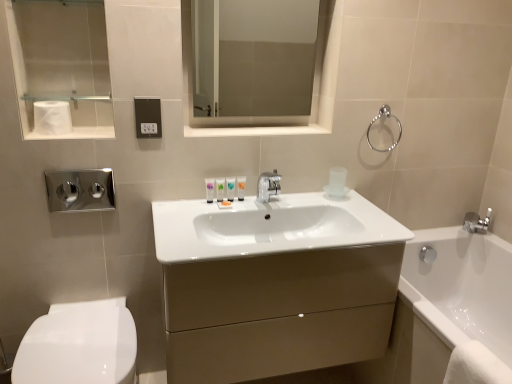
Where is `vacant space to the right of matte purple tube at center, the fourth toiletry from the right`? The width and height of the screenshot is (512, 384). vacant space to the right of matte purple tube at center, the fourth toiletry from the right is located at coordinates (x=247, y=206).